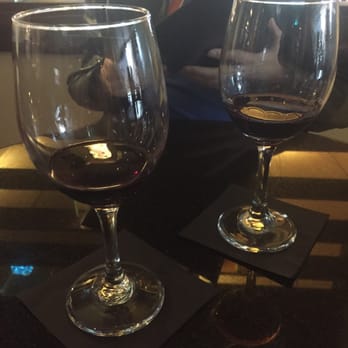
Image resolution: width=348 pixels, height=348 pixels. Find the location of `base  of right wineglass`. base  of right wineglass is located at coordinates (272, 214).